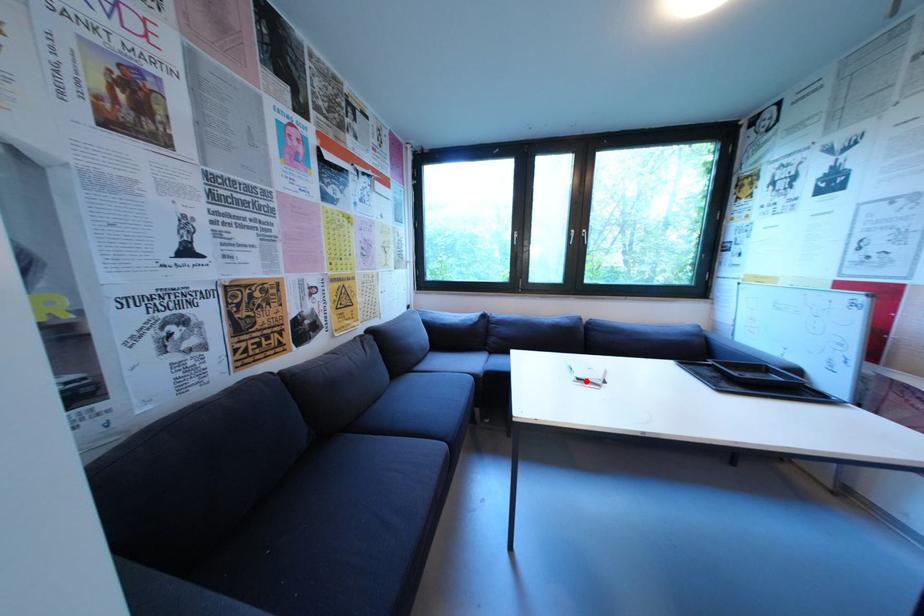
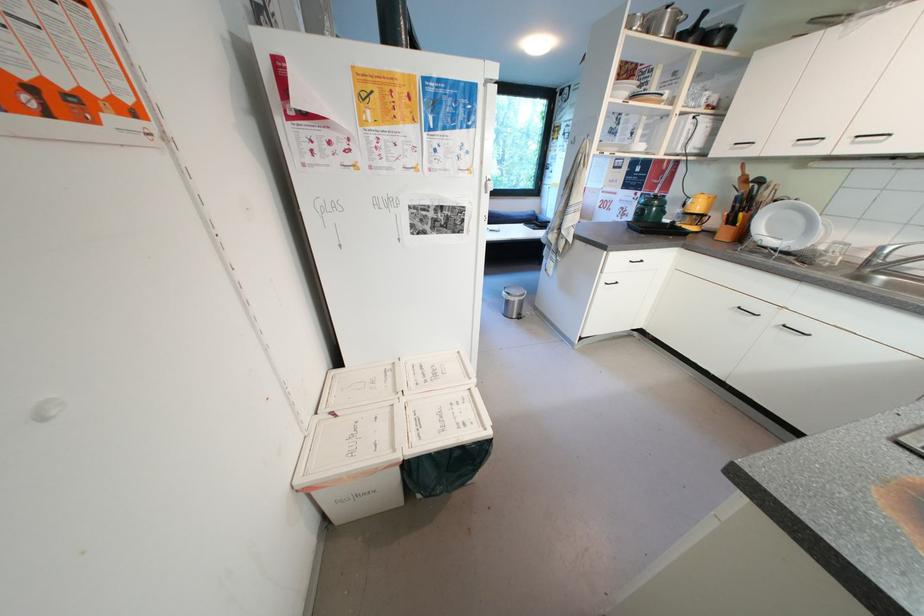
Question: I am providing you with two images of the same scene from different viewpoints. A red point is marked on the first image. Is the red point's position out of view in image 2?

Choices:
 (A) Yes
 (B) No

Answer: (A)